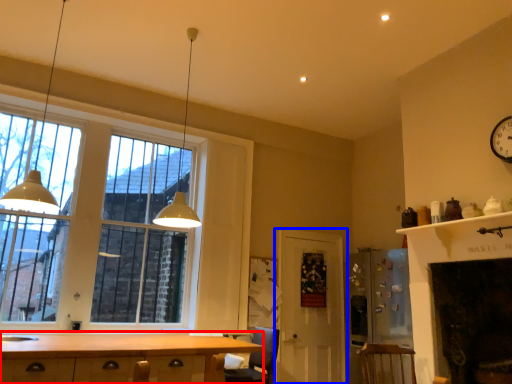
Question: Which object appears closest to the camera in this image, cabinetry (highlighted by a red box) or door (highlighted by a blue box)?

Choices:
 (A) cabinetry
 (B) door

Answer: (A)